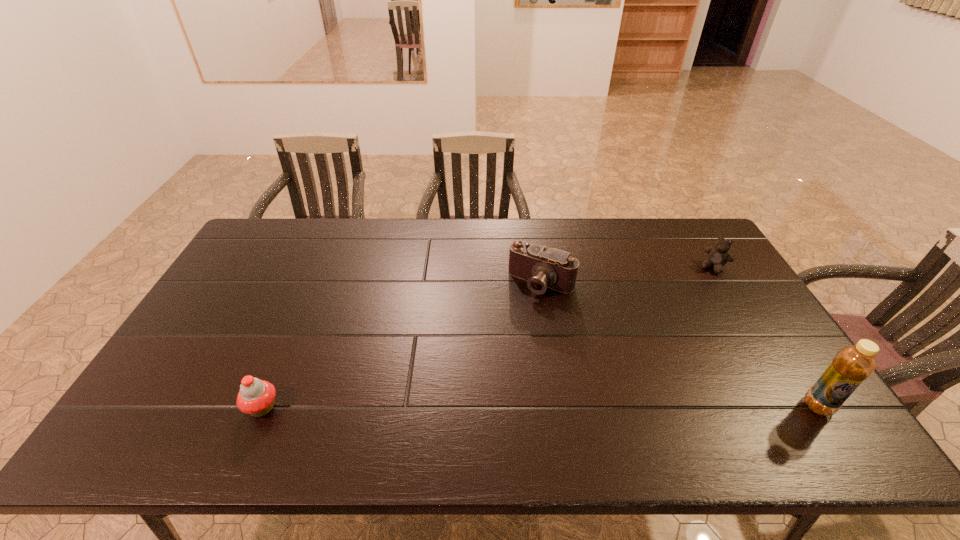
The height and width of the screenshot is (540, 960). Identify the location of blank space located on the front-facing side of the camera. (484, 368).

The width and height of the screenshot is (960, 540). I want to click on free space located on the front-facing side of the camera, so click(x=486, y=365).

Find the location of a particular element. The width and height of the screenshot is (960, 540). object present at the far edge is located at coordinates (718, 256).

The width and height of the screenshot is (960, 540). I want to click on cupcake that is positioned at the near edge, so click(256, 397).

You are a GUI agent. You are given a task and a screenshot of the screen. Output one action in this format:
    pyautogui.click(x=<x>, y=<y>)
    Task: Click on the bottle that is at the near edge
    The height and width of the screenshot is (540, 960).
    Given the screenshot: What is the action you would take?
    pyautogui.click(x=852, y=365)

You are a GUI agent. You are given a task and a screenshot of the screen. Output one action in this format:
    pyautogui.click(x=<x>, y=<y>)
    Task: Click on the bottle located in the right edge section of the desktop
    This screenshot has width=960, height=540.
    Given the screenshot: What is the action you would take?
    pyautogui.click(x=852, y=365)

Image resolution: width=960 pixels, height=540 pixels. I want to click on teddy bear positioned at the right edge, so click(718, 256).

You are a GUI agent. You are given a task and a screenshot of the screen. Output one action in this format:
    pyautogui.click(x=<x>, y=<y>)
    Task: Click on the object at the far right corner
    The width and height of the screenshot is (960, 540).
    Given the screenshot: What is the action you would take?
    [x=718, y=256]

This screenshot has width=960, height=540. Identify the location of object that is positioned at the near right corner. (852, 365).

Identify the location of vacant space at the far edge of the desktop. The width and height of the screenshot is (960, 540). (451, 258).